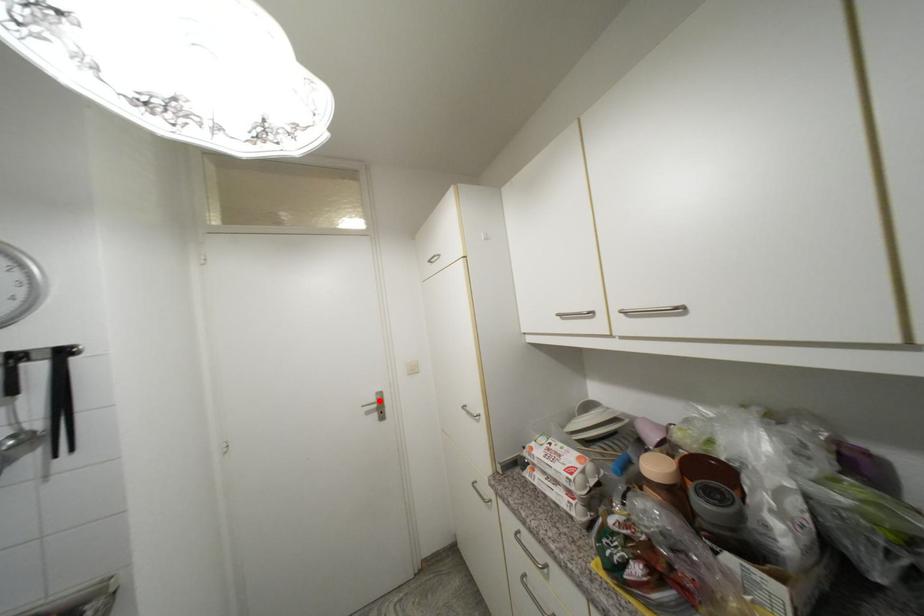
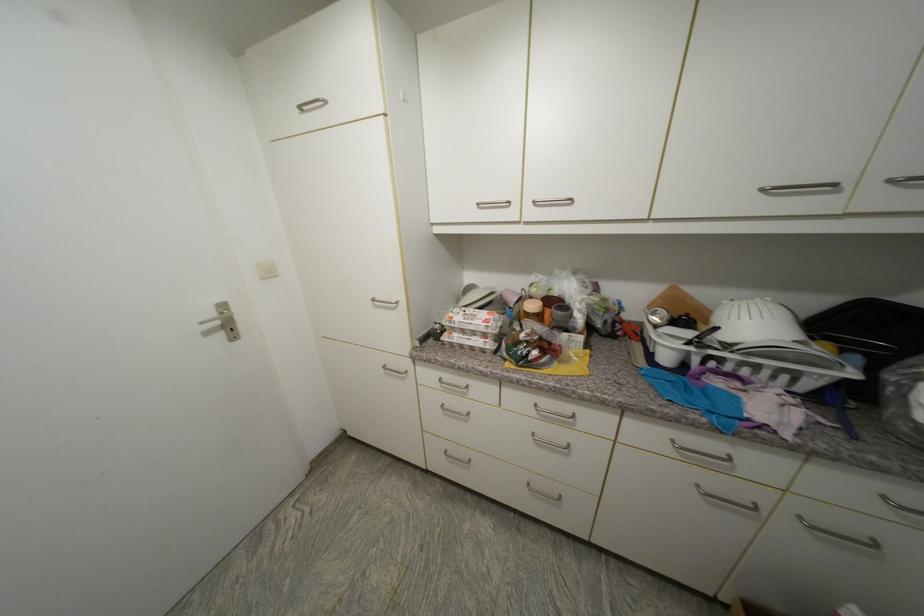
Locate, in the second image, the point that corresponds to the highlighted location in the first image.

(220, 315)